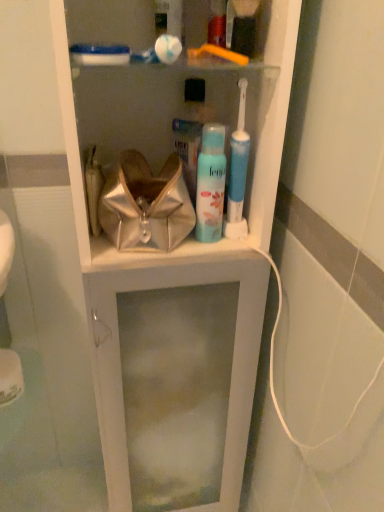
Question: From the image's perspective, is blue matte spray can at center positioned above or below metallic shiny handbag at center?

Choices:
 (A) below
 (B) above

Answer: (A)

Question: Is point (220, 131) closer or farther from the camera than point (112, 205)?

Choices:
 (A) closer
 (B) farther

Answer: (A)

Question: Is blue matte spray can at center inside or outside of metallic shiny handbag at center?

Choices:
 (A) outside
 (B) inside

Answer: (A)

Question: Is metallic shiny handbag at center inside or outside of blue matte spray can at center?

Choices:
 (A) outside
 (B) inside

Answer: (A)

Question: Is metallic shiny handbag at center to the left or to the right of blue matte spray can at center in the image?

Choices:
 (A) left
 (B) right

Answer: (A)

Question: Looking at their shapes, would you say metallic shiny handbag at center is wider or thinner than blue matte spray can at center?

Choices:
 (A) wide
 (B) thin

Answer: (A)

Question: Is metallic shiny handbag at center taller or shorter than blue matte spray can at center?

Choices:
 (A) short
 (B) tall

Answer: (A)